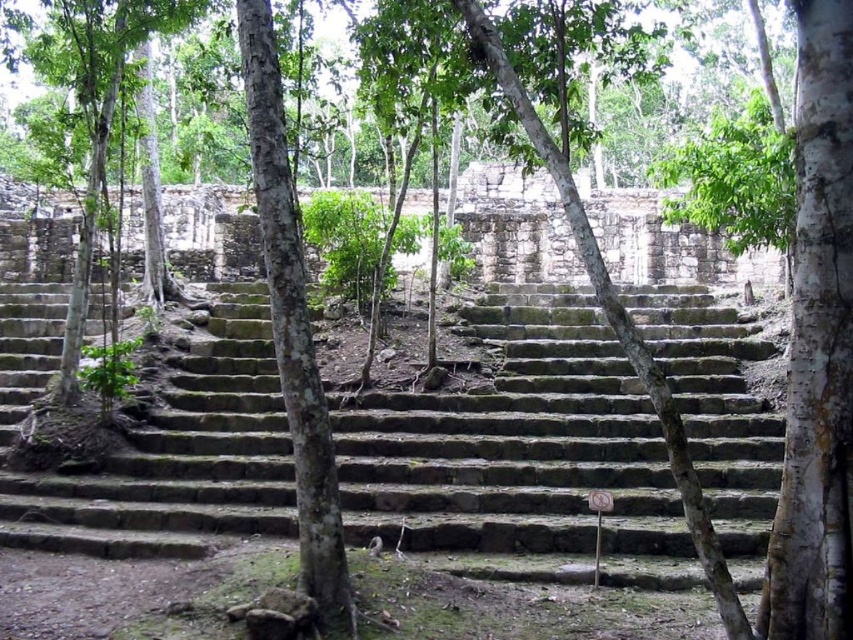
Question: Which object is positioned farthest from the white textured bark at right?

Choices:
 (A) green rough bark tree at center
 (B) green mossy stone stairs at center

Answer: (B)

Question: Is green mossy stone stairs at center to the right of white textured bark at right from the viewer's perspective?

Choices:
 (A) no
 (B) yes

Answer: (A)

Question: Which object appears farthest from the camera in this image?

Choices:
 (A) green rough bark tree at center
 (B) green mossy stone stairs at center

Answer: (B)

Question: Does green mossy stone stairs at center lie in front of white textured bark at right?

Choices:
 (A) no
 (B) yes

Answer: (A)

Question: Is green mossy stone stairs at center above white textured bark at right?

Choices:
 (A) yes
 (B) no

Answer: (B)

Question: Which is nearer to the green mossy stone stairs at center?

Choices:
 (A) green rough bark tree at center
 (B) white textured bark at right

Answer: (A)